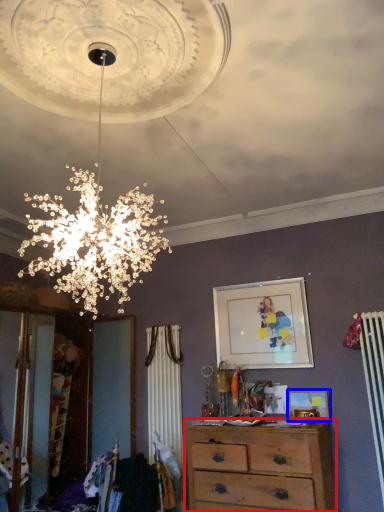
Question: Which object appears closest to the camera in this image, chest of drawers (highlighted by a red box) or picture frame (highlighted by a blue box)?

Choices:
 (A) chest of drawers
 (B) picture frame

Answer: (A)